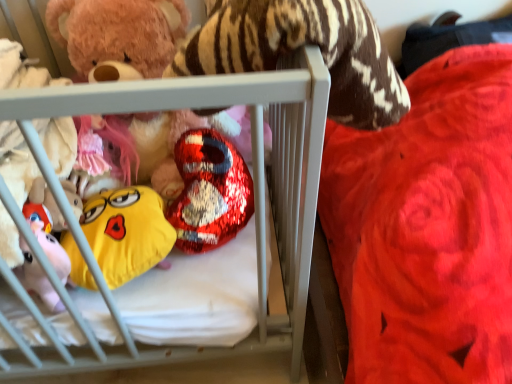
Question: Does shiny metallic heart at center, marked as the third toy in a bottom-to-top arrangement, lie behind yellow plush emoji at center, marked as the first toy in a bottom-to-top arrangement?

Choices:
 (A) yes
 (B) no

Answer: (A)

Question: Is yellow plush emoji at center, which is the third toy from top to bottom, at the back of shiny metallic heart at center, which ranks as the 1th toy in top-to-bottom order?

Choices:
 (A) yes
 (B) no

Answer: (B)

Question: Is shiny metallic heart at center, which ranks as the 1th toy in top-to-bottom order, taller than yellow plush emoji at center, marked as the first toy in a bottom-to-top arrangement?

Choices:
 (A) no
 (B) yes

Answer: (B)

Question: Can you confirm if shiny metallic heart at center, marked as the third toy in a bottom-to-top arrangement, is positioned to the left of yellow plush emoji at center, which is the third toy from top to bottom?

Choices:
 (A) yes
 (B) no

Answer: (A)

Question: Is shiny metallic heart at center, which ranks as the 1th toy in top-to-bottom order, bigger than yellow plush emoji at center, marked as the first toy in a bottom-to-top arrangement?

Choices:
 (A) yes
 (B) no

Answer: (A)

Question: Looking at the image, does soft white crib at center seem bigger or smaller compared to shiny metallic heart at center, which ranks as the 1th toy in top-to-bottom order?

Choices:
 (A) small
 (B) big

Answer: (B)

Question: From their relative heights in the image, would you say soft white crib at center is taller or shorter than shiny metallic heart at center, marked as the third toy in a bottom-to-top arrangement?

Choices:
 (A) tall
 (B) short

Answer: (A)

Question: Is point (83, 92) positioned closer to the camera than point (117, 74)?

Choices:
 (A) closer
 (B) farther

Answer: (A)

Question: Looking at their shapes, would you say soft white crib at center is wider or thinner than shiny metallic heart at center, which ranks as the 1th toy in top-to-bottom order?

Choices:
 (A) wide
 (B) thin

Answer: (A)

Question: Would you say soft white crib at center is inside or outside shiny metallic heart at center, which is the second toy from bottom to top?

Choices:
 (A) inside
 (B) outside

Answer: (B)

Question: Based on their sizes in the image, would you say soft white crib at center is bigger or smaller than shiny metallic heart at center, acting as the 2th toy starting from the top?

Choices:
 (A) big
 (B) small

Answer: (A)

Question: Does point (190, 94) appear closer or farther from the camera than point (209, 213)?

Choices:
 (A) farther
 (B) closer

Answer: (B)

Question: From a real-world perspective, is soft white crib at center above or below shiny metallic heart at center, which is the second toy from bottom to top?

Choices:
 (A) below
 (B) above

Answer: (B)

Question: From the image's perspective, is yellow plush emoji at center, which is the third toy from top to bottom, positioned above or below shiny metallic heart at center, acting as the 2th toy starting from the top?

Choices:
 (A) below
 (B) above

Answer: (A)

Question: Is yellow plush emoji at center, which is the third toy from top to bottom, in front of or behind shiny metallic heart at center, acting as the 2th toy starting from the top, in the image?

Choices:
 (A) behind
 (B) front

Answer: (B)